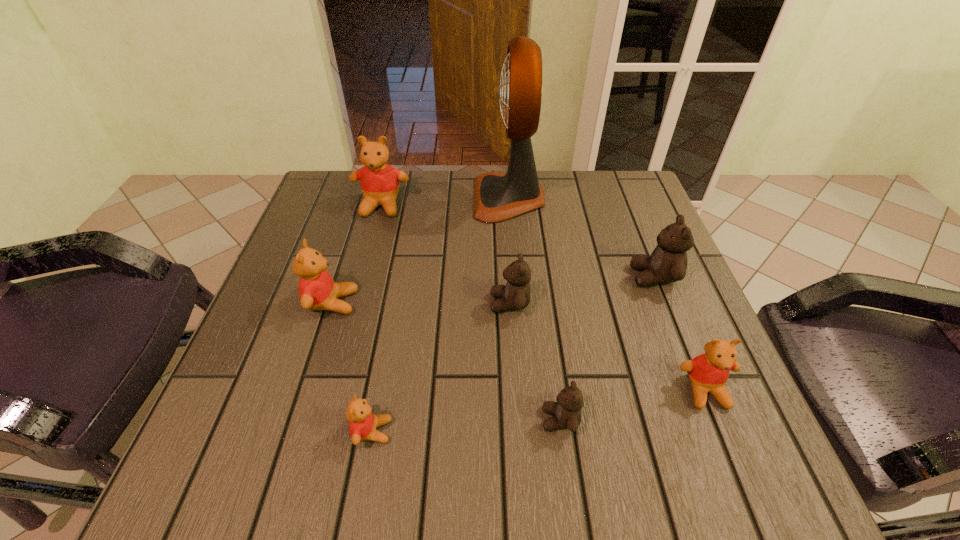
Locate an element on the screen. This screenshot has height=540, width=960. vacant area located 0.110m on the face of the second smallest brown teddy bear is located at coordinates (436, 303).

The height and width of the screenshot is (540, 960). In order to click on free space located on the face of the second smallest brown teddy bear in this screenshot , I will do `click(352, 303)`.

This screenshot has height=540, width=960. In order to click on blank space located 0.160m on the face of the second smallest brown teddy bear in this screenshot , I will do `click(411, 303)`.

I want to click on free spot located on the front-facing side of the rightmost red teddy bear, so click(733, 460).

The image size is (960, 540). In order to click on vacant space located on the face of the second brown teddy bear from left to right in this screenshot , I will do `click(326, 419)`.

Identify the location of free space located 0.150m on the face of the second brown teddy bear from left to right. Image resolution: width=960 pixels, height=540 pixels. (449, 419).

What are the coordinates of `vacant point located on the face of the second brown teddy bear from left to right` in the screenshot? It's located at (x=302, y=419).

Image resolution: width=960 pixels, height=540 pixels. What are the coordinates of `vacant point located 0.130m on the front-facing side of the smallest red teddy bear` in the screenshot? It's located at (472, 431).

You are a GUI agent. You are given a task and a screenshot of the screen. Output one action in this format:
    pyautogui.click(x=<x>, y=<y>)
    Task: Click on the fan at the far edge
    The height and width of the screenshot is (540, 960).
    Given the screenshot: What is the action you would take?
    pyautogui.click(x=497, y=197)

Where is `teddy bear at the far edge`? teddy bear at the far edge is located at coordinates (379, 181).